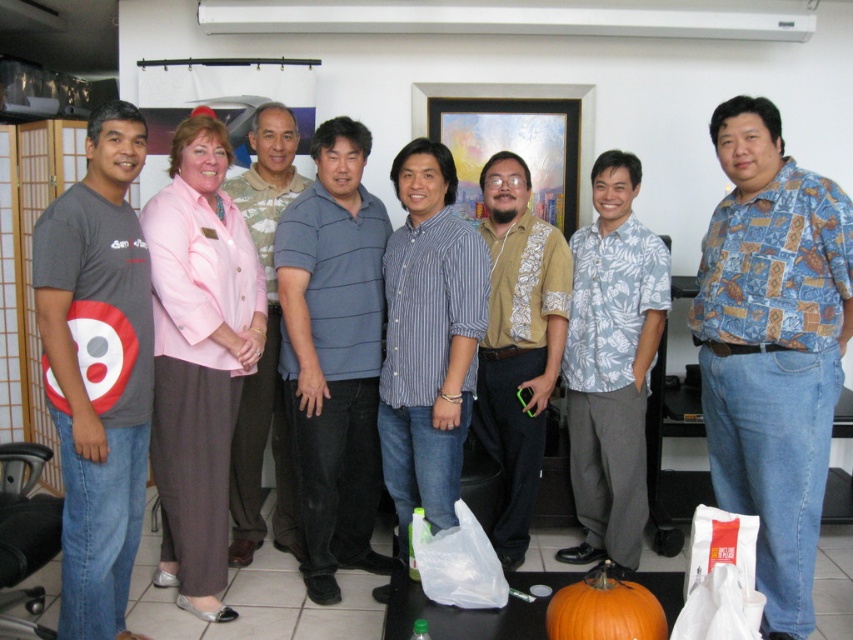
Question: Which of these objects is positioned closest to the orange matte pumpkin at lower center?

Choices:
 (A) blue striped polo shirt at center
 (B) blue patchwork shirt at center
 (C) light blue shirt at center
 (D) blue striped shirt at center

Answer: (B)

Question: Which of the following is the farthest from the observer?

Choices:
 (A) (587, 262)
 (B) (86, 365)
 (C) (445, 369)

Answer: (A)

Question: Is blue patchwork shirt at center closer to camera compared to beige patterned shirt at center?

Choices:
 (A) yes
 (B) no

Answer: (A)

Question: Does blue striped polo shirt at center appear on the left side of beige patterned shirt at center?

Choices:
 (A) no
 (B) yes

Answer: (B)

Question: Does gray matte t-shirt at left have a smaller size compared to light blue shirt at center?

Choices:
 (A) no
 (B) yes

Answer: (B)

Question: Which object appears closest to the camera in this image?

Choices:
 (A) blue patchwork shirt at center
 (B) blue striped shirt at center

Answer: (A)